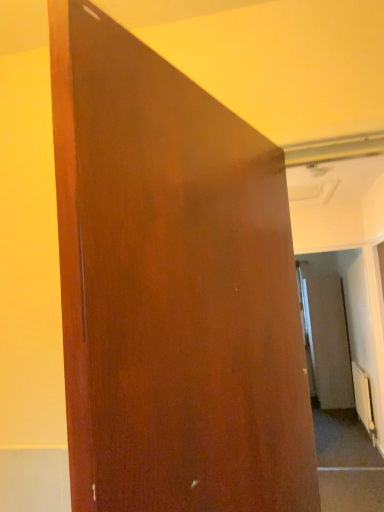
Question: Is the position of matte wood door at center less distant than that of matte brown screen door at right?

Choices:
 (A) no
 (B) yes

Answer: (B)

Question: Is matte wood door at center positioned with its back to matte brown screen door at right?

Choices:
 (A) yes
 (B) no

Answer: (B)

Question: Could you tell me if matte wood door at center is turned towards matte brown screen door at right?

Choices:
 (A) yes
 (B) no

Answer: (B)

Question: Considering the relative sizes of matte wood door at center and matte brown screen door at right in the image provided, is matte wood door at center smaller than matte brown screen door at right?

Choices:
 (A) yes
 (B) no

Answer: (A)

Question: Are matte wood door at center and matte brown screen door at right far apart?

Choices:
 (A) no
 (B) yes

Answer: (B)

Question: Based on their positions, is matte brown screen door at right located to the left or right of matte wood door at center?

Choices:
 (A) left
 (B) right

Answer: (B)

Question: In terms of height, does matte brown screen door at right look taller or shorter compared to matte wood door at center?

Choices:
 (A) short
 (B) tall

Answer: (B)

Question: From the image's perspective, is matte brown screen door at right positioned above or below matte wood door at center?

Choices:
 (A) below
 (B) above

Answer: (A)

Question: Does point pos(324,377) appear closer or farther from the camera than point pos(96,281)?

Choices:
 (A) closer
 (B) farther

Answer: (B)

Question: Visually, is white metallic radiator at lower right positioned to the left or to the right of matte wood door at center?

Choices:
 (A) left
 (B) right

Answer: (B)

Question: From a real-world perspective, is white metallic radiator at lower right physically located above or below matte wood door at center?

Choices:
 (A) below
 (B) above

Answer: (A)

Question: Is white metallic radiator at lower right in front of or behind matte wood door at center in the image?

Choices:
 (A) behind
 (B) front

Answer: (A)

Question: Considering the positions of white metallic radiator at lower right and matte wood door at center in the image, is white metallic radiator at lower right wider or thinner than matte wood door at center?

Choices:
 (A) thin
 (B) wide

Answer: (B)

Question: From a real-world perspective, is matte wood door at center above or below white metallic radiator at lower right?

Choices:
 (A) below
 (B) above

Answer: (B)

Question: Does point (96, 453) appear closer or farther from the camera than point (365, 373)?

Choices:
 (A) closer
 (B) farther

Answer: (A)